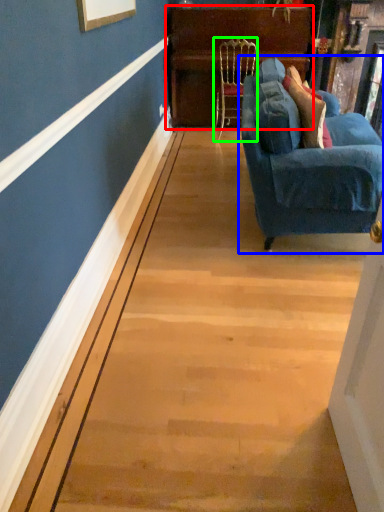
Question: Which object is positioned closest to dresser (highlighted by a red box)? Select from studio couch (highlighted by a blue box) and chair (highlighted by a green box).

Choices:
 (A) studio couch
 (B) chair

Answer: (B)